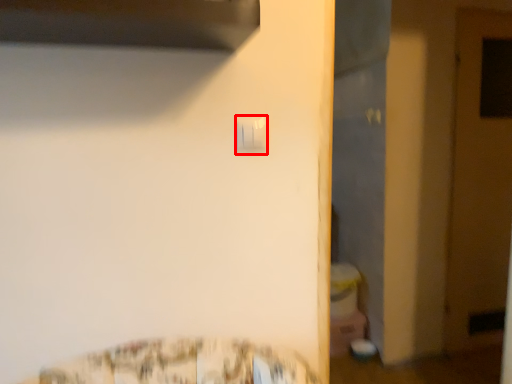
Question: From the image's perspective, considering the relative positions of light switch (annotated by the red box) and door in the image provided, where is light switch (annotated by the red box) located with respect to the staircase?

Choices:
 (A) below
 (B) above

Answer: (B)